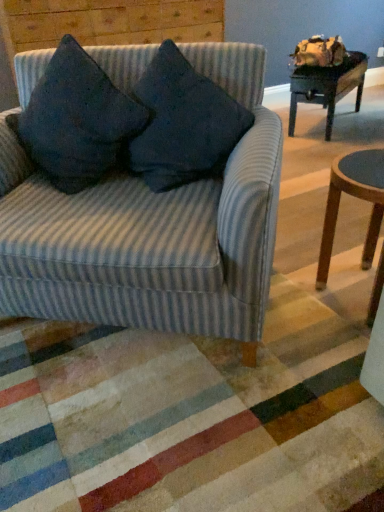
In order to click on vacant area in front of striped fabric couch at left in this screenshot , I will do `click(152, 430)`.